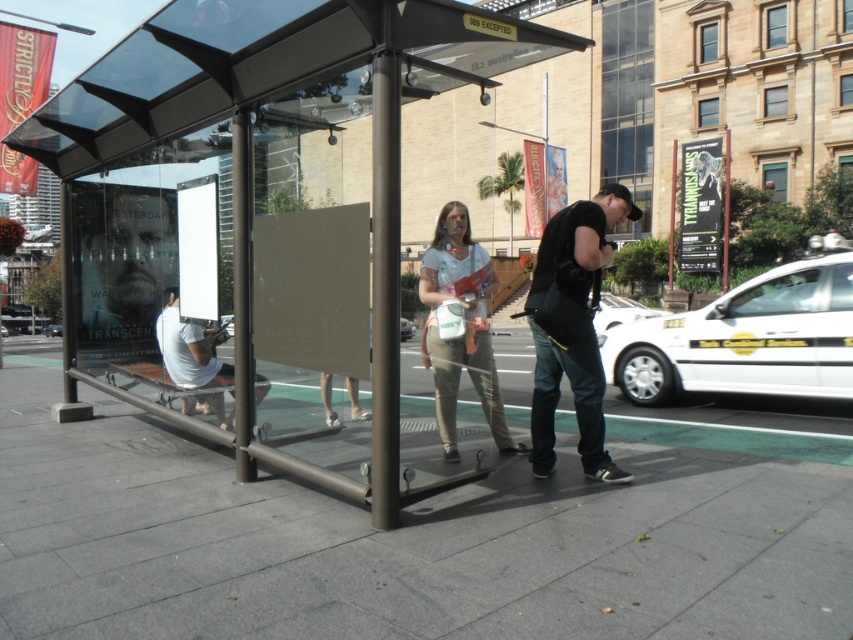
Question: Is gray concrete pavement at center wider than white matte shirt at lower left?

Choices:
 (A) no
 (B) yes

Answer: (B)

Question: Which point is closer to the camera?

Choices:
 (A) transparent glass canopy at upper center
 (B) white glossy taxi at right

Answer: (B)

Question: Which object is the closest to the transparent glass bus stop at center?

Choices:
 (A) gray concrete pavement at center
 (B) transparent glass canopy at upper center

Answer: (A)

Question: Estimate the real-world distances between objects in this image. Which object is farther from the light brown fabric pants at center?

Choices:
 (A) white glossy taxi at right
 (B) transparent glass bus stop at center

Answer: (B)

Question: In this image, where is transparent glass bus stop at center located relative to light brown fabric pants at center?

Choices:
 (A) left
 (B) right

Answer: (B)

Question: Is transparent glass bus stop at center wider than white matte shirt at lower left?

Choices:
 (A) yes
 (B) no

Answer: (A)